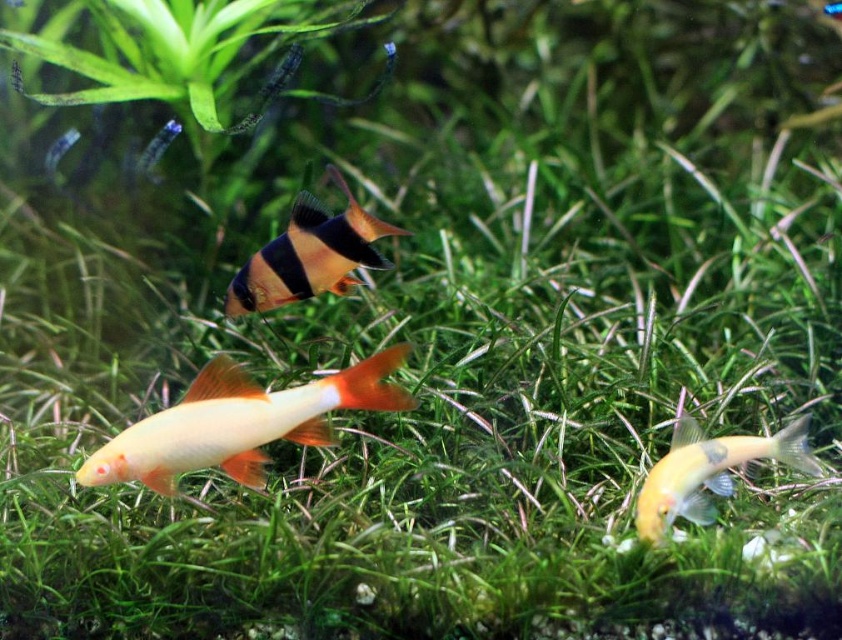
You are an underwater photographer aiming to capture a closeup of the fish located at point (126, 461) and the fish at point (334, 288). Since you want both fish in focus, which fish should you focus on first to ensure the other is also in focus?

You should focus on the fish at point (126, 461) first because it is closer to the viewer than the fish at point (334, 288). By focusing on the closer fish, the farther one will also be within the depth of field, ensuring both are in focus.

Based on the photo, you are an underwater photographer aiming to capture a photo of both the black and orange striped fish at center and the shiny yellow fish at lower right. Based on their sizes, which fish should you focus on first to ensure they are fully in frame?

The black and orange striped fish at center is much taller than the shiny yellow fish at lower right, so you should focus on the black and orange striped fish at center first to ensure it fits within the frame.